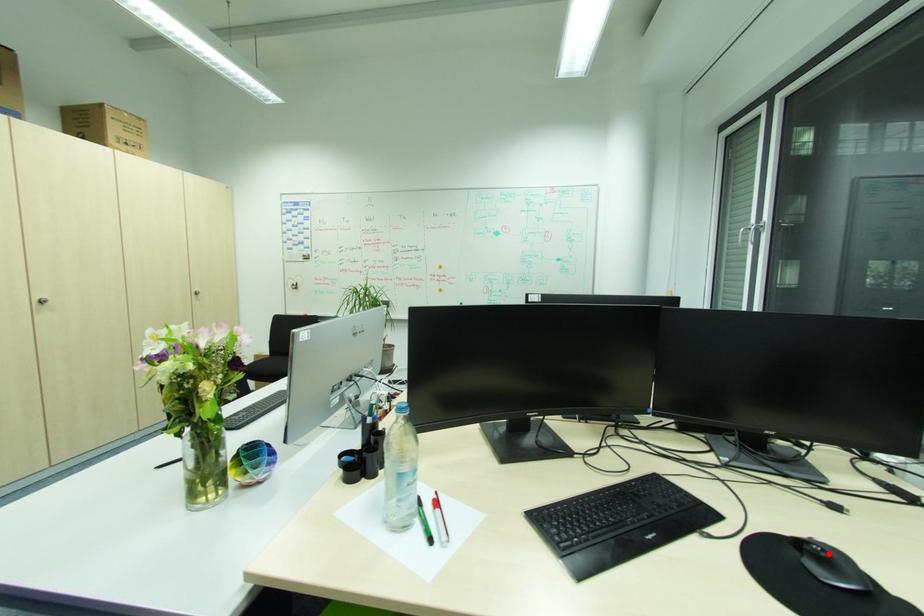
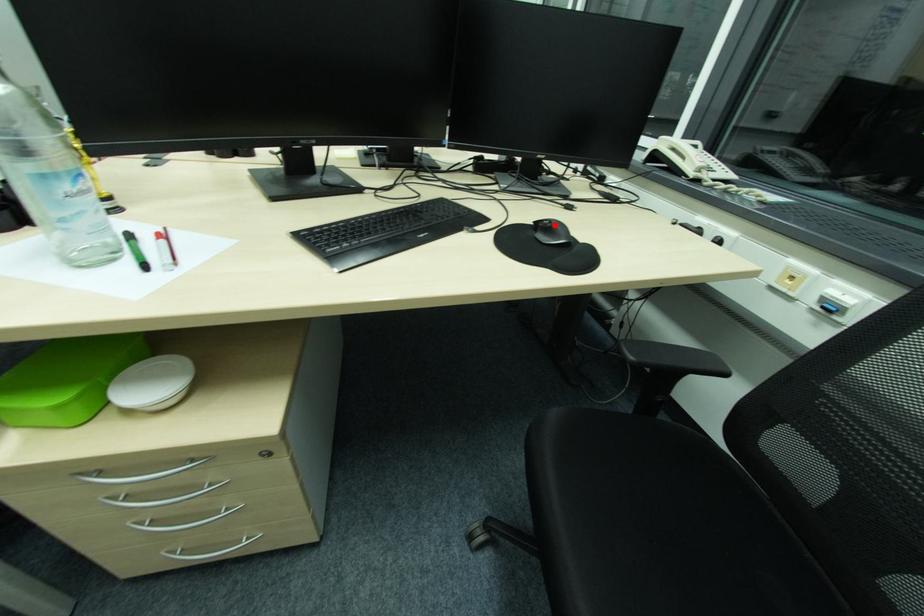
I am providing you with two images of the same scene from different viewpoints. A red point is marked on the first image and another point is marked on the second image. Do the highlighted points in image1 and image2 indicate the same real-world spot?

Yes